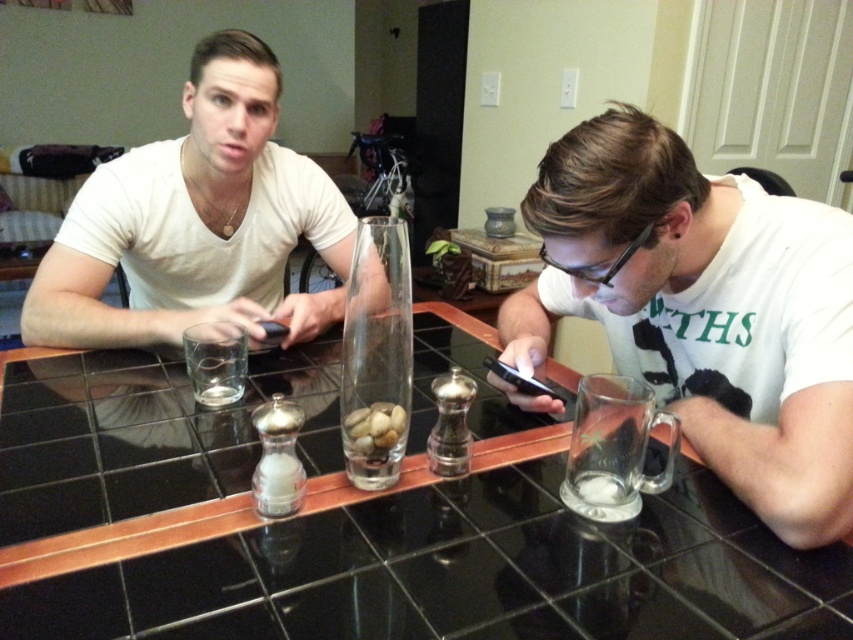
You are arranging a small plant on the black glass table at center and the clear glass mug at right. Which object should you place the plant on to ensure it is closer to the left side of the table?

You should place the plant on the black glass table at center because it is positioned on the left side of the clear glass mug at right, making it closer to the left side of the table.